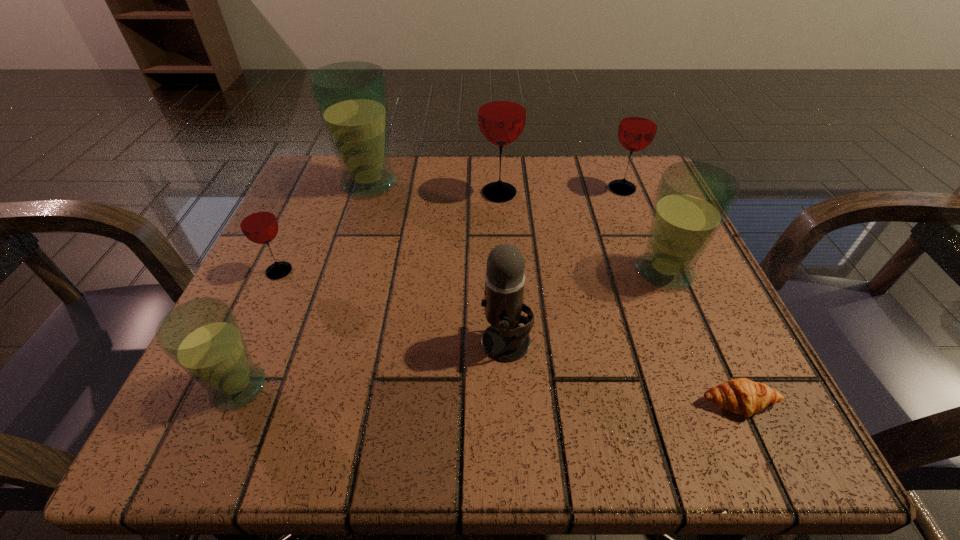
This screenshot has height=540, width=960. Identify the location of the nearest glass. (202, 336).

Find the location of a particular element. The height and width of the screenshot is (540, 960). the shortest object is located at coordinates (742, 396).

Where is `free space located on the back of the second red glass from right to left`? Image resolution: width=960 pixels, height=540 pixels. free space located on the back of the second red glass from right to left is located at coordinates (497, 157).

Where is `free location located 0.120m on the right of the farthest blue glass`? The height and width of the screenshot is (540, 960). free location located 0.120m on the right of the farthest blue glass is located at coordinates (458, 184).

Where is `free space located 0.300m on the left of the second biggest red glass`? Image resolution: width=960 pixels, height=540 pixels. free space located 0.300m on the left of the second biggest red glass is located at coordinates click(x=460, y=188).

Where is `vacant space situated 0.200m on the left of the second smallest blue glass`? Image resolution: width=960 pixels, height=540 pixels. vacant space situated 0.200m on the left of the second smallest blue glass is located at coordinates (514, 272).

I want to click on vacant space located 0.160m on the left of the microphone, so [370, 343].

The image size is (960, 540). I want to click on vacant position located on the right of the smallest red glass, so (516, 271).

Where is `free space located on the back of the smallest blue glass`? This screenshot has width=960, height=540. free space located on the back of the smallest blue glass is located at coordinates (286, 280).

Where is `glass that is at the near edge`? glass that is at the near edge is located at coordinates (202, 336).